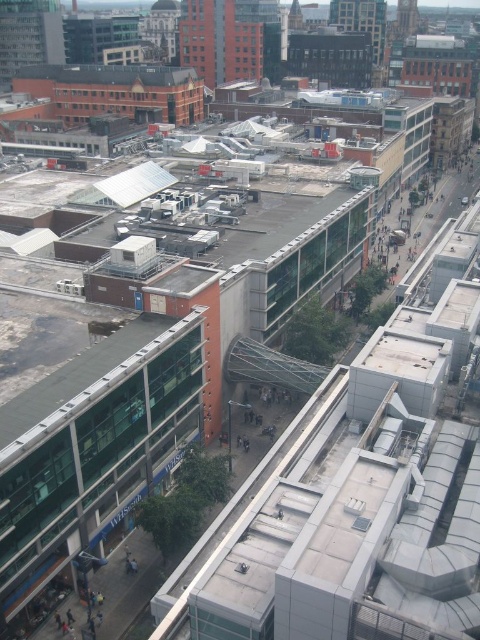
Describe the element at coordinates (75, 385) in the screenshot. I see `green glass roof at center` at that location.

Between green glass roof at center and brown corrugated metal roof at upper center, which one appears on the right side from the viewer's perspective?

green glass roof at center is more to the right.

Find the location of `green glass roof at center`. green glass roof at center is located at coordinates (75, 385).